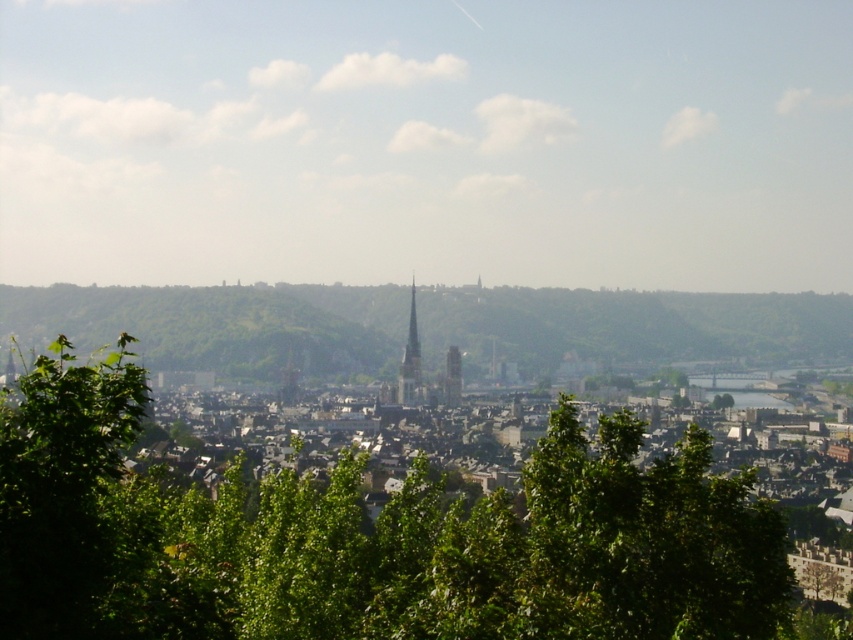
Question: Does green leafy hill at center lie in front of smooth gray spire at center?

Choices:
 (A) yes
 (B) no

Answer: (A)

Question: Is green leafy tree at center above smooth stone tower at center?

Choices:
 (A) yes
 (B) no

Answer: (B)

Question: Among these points, which one is nearest to the camera?

Choices:
 (A) (397, 385)
 (B) (357, 528)
 (C) (444, 387)
 (D) (287, 321)

Answer: (B)

Question: Which of these objects is positioned farthest from the green leafy hill at center?

Choices:
 (A) green leafy tree at center
 (B) smooth gray spire at center

Answer: (A)

Question: Does green leafy hill at center have a smaller size compared to smooth stone tower at center?

Choices:
 (A) yes
 (B) no

Answer: (B)

Question: Which object is closer to the camera taking this photo?

Choices:
 (A) smooth gray spire at center
 (B) smooth stone tower at center
 (C) green leafy hill at center
 (D) green leafy tree at center

Answer: (D)